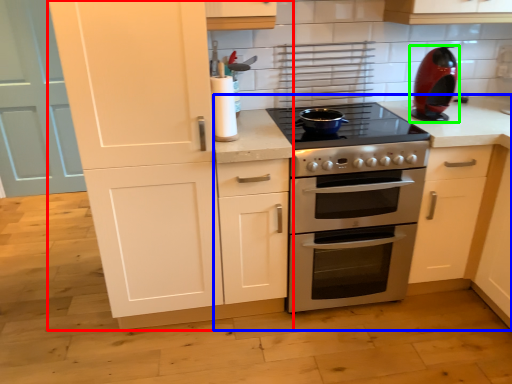
Question: Estimate the real-world distances between objects in this image. Which object is farther from cabinetry (highlighted by a red box), countertop (highlighted by a blue box) or kitchen appliance (highlighted by a green box)?

Choices:
 (A) countertop
 (B) kitchen appliance

Answer: (B)